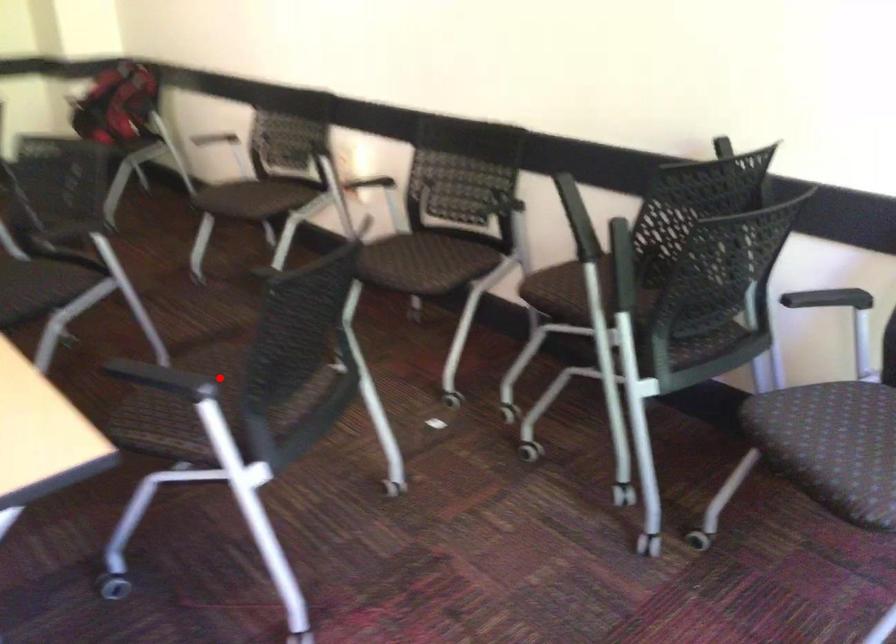
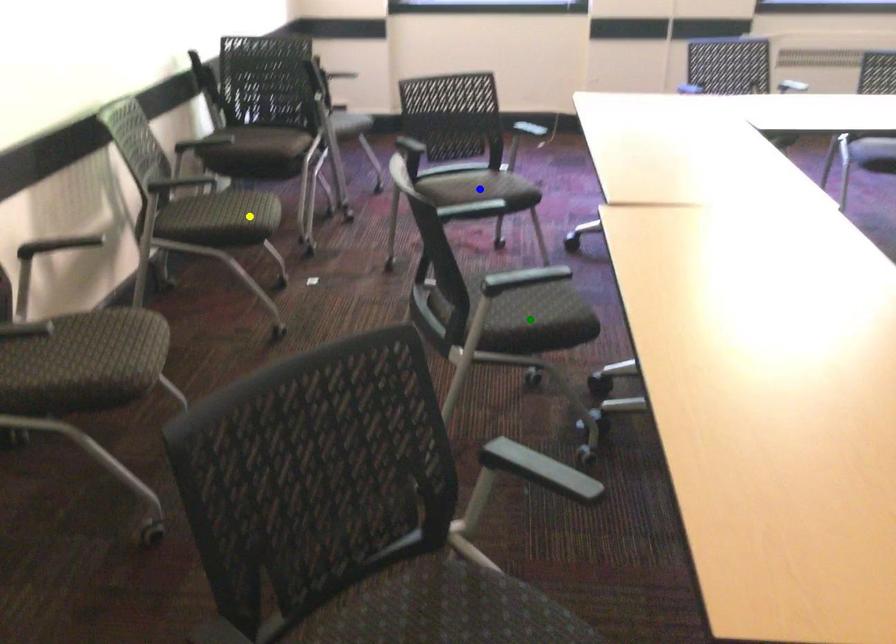
Question: I am providing you with two images of the same scene from different viewpoints. A red point is marked on the first image. You are given multiple points on the second image. Which point in image 2 represents the same 3d spot as the red point in image 1?

Choices:
 (A) blue point
 (B) green point
 (C) yellow point

Answer: (A)